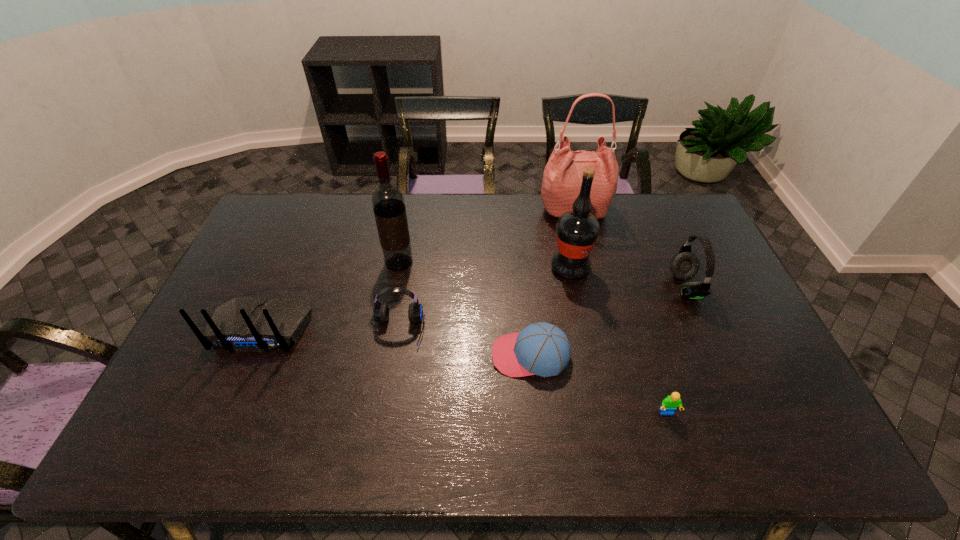
I want to click on vacant area between the right headset and the leftmost object, so click(473, 308).

At what (x,y) coordinates should I click in order to perform the action: click on free space between the baseball cap and the nearest object. Please return your answer as a coordinate pair (x, y). The image size is (960, 540). Looking at the image, I should click on (599, 384).

The image size is (960, 540). Find the location of `vacant region between the farthest object and the rightmost object`. vacant region between the farthest object and the rightmost object is located at coordinates (629, 248).

I want to click on blank region between the left headset and the baseball cap, so click(x=465, y=343).

This screenshot has width=960, height=540. Find the location of `blank region between the nearer headset and the left wine bottle`. blank region between the nearer headset and the left wine bottle is located at coordinates (399, 296).

You are a GUI agent. You are given a task and a screenshot of the screen. Output one action in this format:
    pyautogui.click(x=<x>, y=<y>)
    Task: Click on the free spot between the farthest object and the left headset
    
    Given the screenshot: What is the action you would take?
    pyautogui.click(x=487, y=270)

Where is `free space between the nearest object and the baseball cap`? free space between the nearest object and the baseball cap is located at coordinates (599, 384).

This screenshot has height=540, width=960. Find the location of `free space between the leftmost object and the handbag`. free space between the leftmost object and the handbag is located at coordinates coord(418,269).

Identify which object is the sixth closest to the baseball cap. Please provide its 2D coordinates. Your answer should be formatted as a tuple, i.e. [(x, y)], where the tuple contains the x and y coordinates of a point satisfying the conditions above.

[(562, 178)]

Where is `object that can be found as the third closest to the right headset`? object that can be found as the third closest to the right headset is located at coordinates (670, 403).